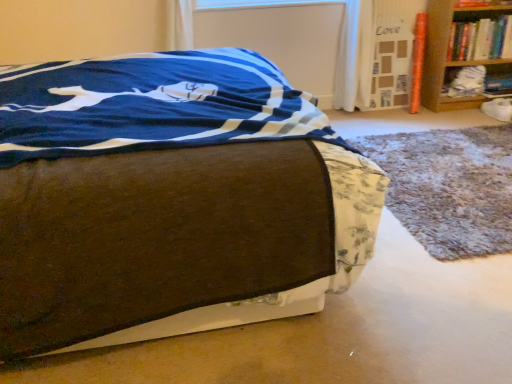
Where is `vacant space underneath fluffy gray rug at lower right (from a real-world perspective)`? vacant space underneath fluffy gray rug at lower right (from a real-world perspective) is located at coordinates (466, 184).